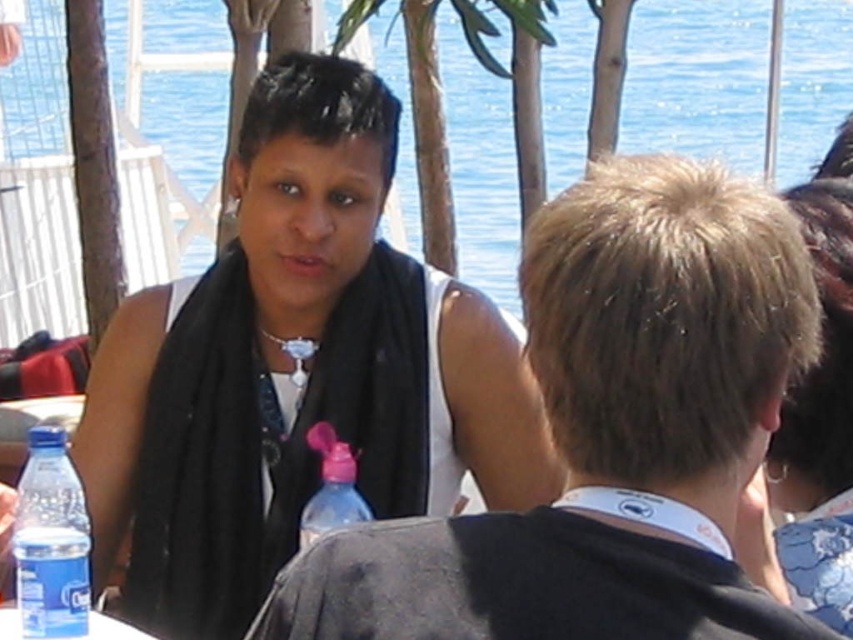
Which is below, blue plastic bottle at lower left or clear plastic bottle at lower left?

Positioned lower is clear plastic bottle at lower left.

Is point (83, 602) farther from camera compared to point (122, 625)?

No, it is in front of (122, 625).

Where is `blue plastic bottle at lower left`? The image size is (853, 640). blue plastic bottle at lower left is located at coordinates (51, 541).

Between point (252, 186) and point (451, 100), which one is positioned behind?

Positioned behind is point (451, 100).

The height and width of the screenshot is (640, 853). In order to click on matte black scarf at center in this screenshot , I will do `click(294, 371)`.

Looking at this image, can you confirm if smooth brown hair at center is shorter than blue plastic bottle at lower left?

Incorrect, smooth brown hair at center's height does not fall short of blue plastic bottle at lower left's.

Does point (642, 156) lie in front of point (70, 486)?

Yes.

The width and height of the screenshot is (853, 640). In order to click on smooth brown hair at center in this screenshot , I will do `click(608, 433)`.